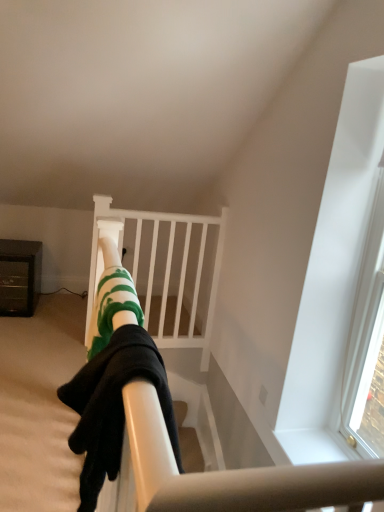
What do you see at coordinates (128, 353) in the screenshot?
I see `green striped socks at center` at bounding box center [128, 353].

Find the location of a particular element. Image resolution: width=384 pixels, height=512 pixels. brushed metal cabinet at left is located at coordinates (19, 276).

The width and height of the screenshot is (384, 512). Find the location of `green striped socks at center`. green striped socks at center is located at coordinates (128, 353).

Between white matte bunk bed at center and green striped socks at center, which one has smaller size?

green striped socks at center.

Who is shorter, white matte bunk bed at center or green striped socks at center?

green striped socks at center.

Between point (173, 258) and point (98, 305), which one is positioned behind?

Point (173, 258)

How different are the orientations of white matte bunk bed at center and green striped socks at center in degrees?

They differ by 89.7 degrees in their facing directions.

Can you confirm if white matte bunk bed at center is shorter than brushed metal cabinet at left?

In fact, white matte bunk bed at center may be taller than brushed metal cabinet at left.

Is white matte bunk bed at center inside the boundaries of brushed metal cabinet at left, or outside?

white matte bunk bed at center is not inside brushed metal cabinet at left, it's outside.

Considering the relative sizes of white matte bunk bed at center and brushed metal cabinet at left in the image provided, is white matte bunk bed at center bigger than brushed metal cabinet at left?

Yes.

Does white matte bunk bed at center have a greater width compared to brushed metal cabinet at left?

In fact, white matte bunk bed at center might be narrower than brushed metal cabinet at left.

Considering the positions of objects brushed metal cabinet at left and white matte bunk bed at center in the image provided, who is more to the left, brushed metal cabinet at left or white matte bunk bed at center?

Positioned to the left is brushed metal cabinet at left.

Does brushed metal cabinet at left turn towards white matte bunk bed at center?

No, brushed metal cabinet at left is not aimed at white matte bunk bed at center.

How far apart are brushed metal cabinet at left and white matte bunk bed at center?

brushed metal cabinet at left and white matte bunk bed at center are 97.87 centimeters apart.

From a real-world perspective, is brushed metal cabinet at left above or below white matte bunk bed at center?

In terms of real-world spatial position, brushed metal cabinet at left is below white matte bunk bed at center.

From the image's perspective, relative to green striped socks at center, is brushed metal cabinet at left above or below?

From the image's perspective, brushed metal cabinet at left appears above green striped socks at center.

From a real-world perspective, is brushed metal cabinet at left located beneath green striped socks at center?

Yes, from a real-world perspective, brushed metal cabinet at left is beneath green striped socks at center.

Does brushed metal cabinet at left touch green striped socks at center?

No, brushed metal cabinet at left is not with green striped socks at center.

This screenshot has width=384, height=512. I want to click on person on the right of brushed metal cabinet at left, so click(x=128, y=353).

Does green striped socks at center have a greater height compared to brushed metal cabinet at left?

Incorrect, the height of green striped socks at center is not larger of that of brushed metal cabinet at left.

Could you tell me if green striped socks at center is facing brushed metal cabinet at left?

No.

Are green striped socks at center and brushed metal cabinet at left far apart?

That's right, there is a large distance between green striped socks at center and brushed metal cabinet at left.

Is green striped socks at center at the left side of brushed metal cabinet at left?

Incorrect, green striped socks at center is not on the left side of brushed metal cabinet at left.

Between green striped socks at center and white matte bunk bed at center, which one has smaller width?

With smaller width is white matte bunk bed at center.

Is the depth of green striped socks at center greater than that of white matte bunk bed at center?

No, the depth of green striped socks at center is less than that of white matte bunk bed at center.

Who is bigger, green striped socks at center or white matte bunk bed at center?

With larger size is white matte bunk bed at center.

Considering the relative sizes of green striped socks at center and white matte bunk bed at center in the image provided, is green striped socks at center taller than white matte bunk bed at center?

No, green striped socks at center is not taller than white matte bunk bed at center.

This screenshot has height=512, width=384. In the image, there is a white matte bunk bed at center. In order to click on person below it (from the image's perspective) in this screenshot , I will do `click(128, 353)`.

This screenshot has height=512, width=384. What are the coordinates of `bunk bed lying on the right of brushed metal cabinet at left` in the screenshot? It's located at (166, 270).

When comparing their distances from white matte bunk bed at center, does brushed metal cabinet at left or green striped socks at center seem closer?

brushed metal cabinet at left.

Looking at the image, which one is located closer to green striped socks at center, white matte bunk bed at center or brushed metal cabinet at left?

white matte bunk bed at center is closer to green striped socks at center.

Looking at the image, which one is located closer to white matte bunk bed at center, green striped socks at center or brushed metal cabinet at left?

The object closer to white matte bunk bed at center is brushed metal cabinet at left.

Based on their spatial positions, is green striped socks at center or white matte bunk bed at center further from brushed metal cabinet at left?

Based on the image, green striped socks at center appears to be further to brushed metal cabinet at left.

Considering their positions, is white matte bunk bed at center positioned further to brushed metal cabinet at left than green striped socks at center?

green striped socks at center is further to brushed metal cabinet at left.

Which object lies further to the anchor point green striped socks at center, brushed metal cabinet at left or white matte bunk bed at center?

brushed metal cabinet at left is positioned further to the anchor green striped socks at center.

The width and height of the screenshot is (384, 512). What are the coordinates of `bunk bed located between green striped socks at center and brushed metal cabinet at left in the depth direction` in the screenshot? It's located at (166, 270).